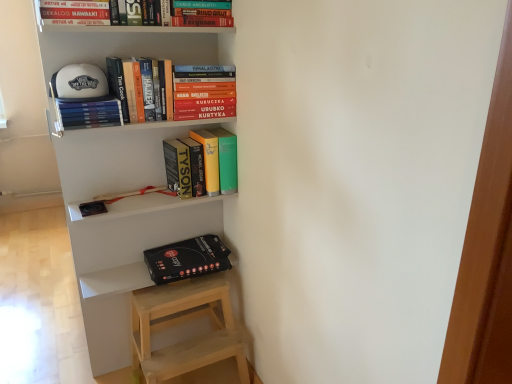
Question: From the image's perspective, is matte yellow book at center, the 5th book in the top-to-bottom sequence, located beneath hardcover book at upper center, which is the 5th book in bottom-to-top order?

Choices:
 (A) no
 (B) yes

Answer: (B)

Question: Considering the relative positions of matte yellow book at center, the 5th book in the top-to-bottom sequence, and hardcover book at upper center, which is the 5th book in bottom-to-top order, in the image provided, is matte yellow book at center, the 5th book in the top-to-bottom sequence, to the left of hardcover book at upper center, which is the 5th book in bottom-to-top order, from the viewer's perspective?

Choices:
 (A) yes
 (B) no

Answer: (B)

Question: Would you say hardcover book at upper center, which is the 5th book in bottom-to-top order, is part of matte yellow book at center, the 1th book from the bottom,'s contents?

Choices:
 (A) no
 (B) yes

Answer: (A)

Question: Is matte yellow book at center, the 5th book in the top-to-bottom sequence, positioned before hardcover book at upper center, the first book in the top-to-bottom sequence?

Choices:
 (A) yes
 (B) no

Answer: (B)

Question: Is matte yellow book at center, the 5th book in the top-to-bottom sequence, positioned with its back to hardcover book at upper center, the first book in the top-to-bottom sequence?

Choices:
 (A) no
 (B) yes

Answer: (A)

Question: From a real-world perspective, is matte yellow book at center, the 5th book in the top-to-bottom sequence, on hardcover book at upper center, the first book in the top-to-bottom sequence?

Choices:
 (A) yes
 (B) no

Answer: (B)

Question: Can you confirm if black matte box at lower left is shorter than white matte bookshelf at upper center?

Choices:
 (A) no
 (B) yes

Answer: (B)

Question: Considering the relative positions of black matte box at lower left and white matte bookshelf at upper center in the image provided, is black matte box at lower left to the right of white matte bookshelf at upper center from the viewer's perspective?

Choices:
 (A) no
 (B) yes

Answer: (B)

Question: From the image's perspective, is black matte box at lower left on white matte bookshelf at upper center?

Choices:
 (A) no
 (B) yes

Answer: (A)

Question: Does black matte box at lower left have a greater height compared to white matte bookshelf at upper center?

Choices:
 (A) no
 (B) yes

Answer: (A)

Question: Does black matte box at lower left have a smaller size compared to white matte bookshelf at upper center?

Choices:
 (A) no
 (B) yes

Answer: (B)

Question: Does black matte box at lower left come behind white matte bookshelf at upper center?

Choices:
 (A) no
 (B) yes

Answer: (B)

Question: Is white matte bookshelf at upper center facing towards black matte box at lower left?

Choices:
 (A) no
 (B) yes

Answer: (B)